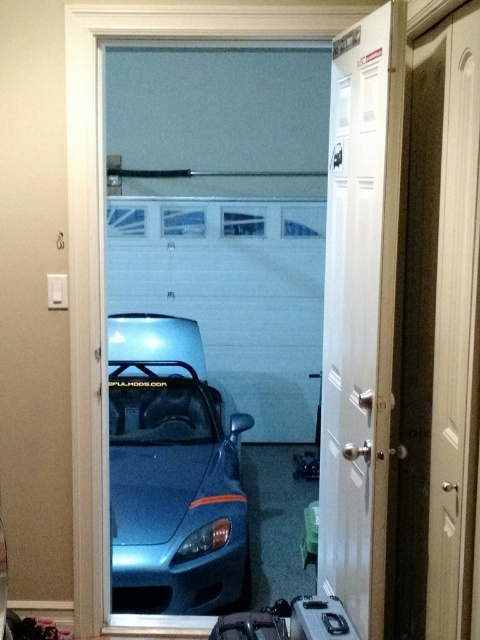
Can you confirm if white glossy door at center is smaller than matte black suitcase at lower center?

No, white glossy door at center is not smaller than matte black suitcase at lower center.

Is point (392, 140) positioned before point (269, 636)?

Yes, it is in front of point (269, 636).

Where is `white glossy door at center`? Image resolution: width=480 pixels, height=640 pixels. white glossy door at center is located at coordinates (360, 314).

Between point (332, 61) and point (187, 344), which one is positioned in front?

Point (332, 61) is more forward.

Which of these two, white glossy door at center or satin blue car at center, stands shorter?

Standing shorter between the two is satin blue car at center.

What are the coordinates of `white glossy door at center` in the screenshot? It's located at (360, 314).

Is satin blue car at center thinner than matte black suitcase at lower center?

No.

Measure the distance between point (192, 504) and camera.

Point (192, 504) is 10.34 feet from camera.

Who is more distant from viewer, (167, 392) or (269, 605)?

Point (167, 392)

Where is `satin blue car at center`? satin blue car at center is located at coordinates (171, 474).